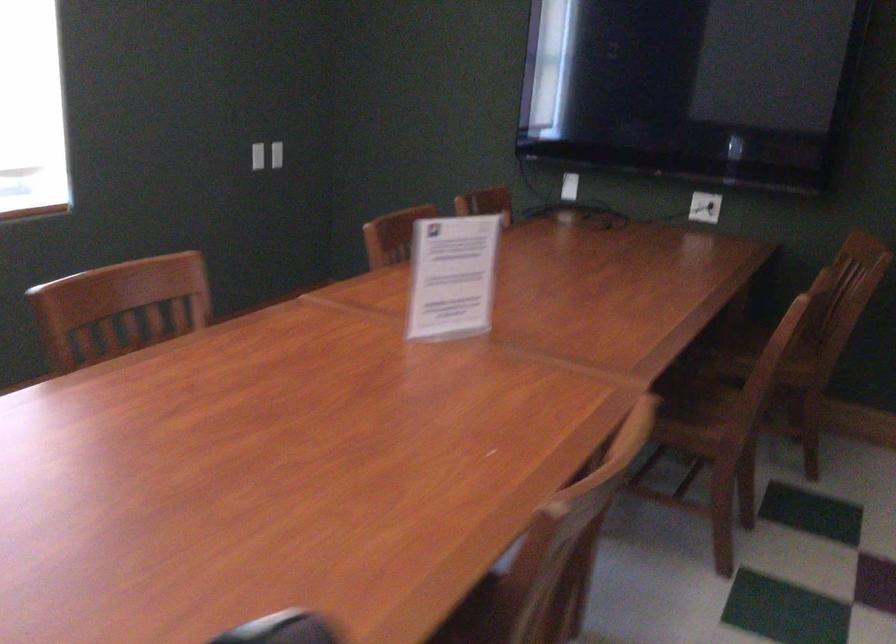
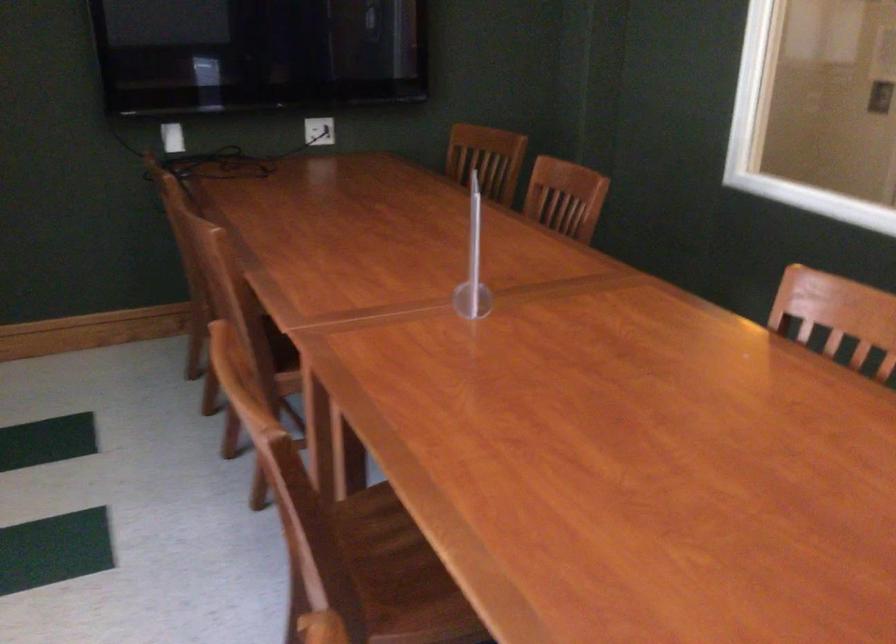
Where in the second image is the point corresponding to point 547,324 from the first image?

(472, 263)